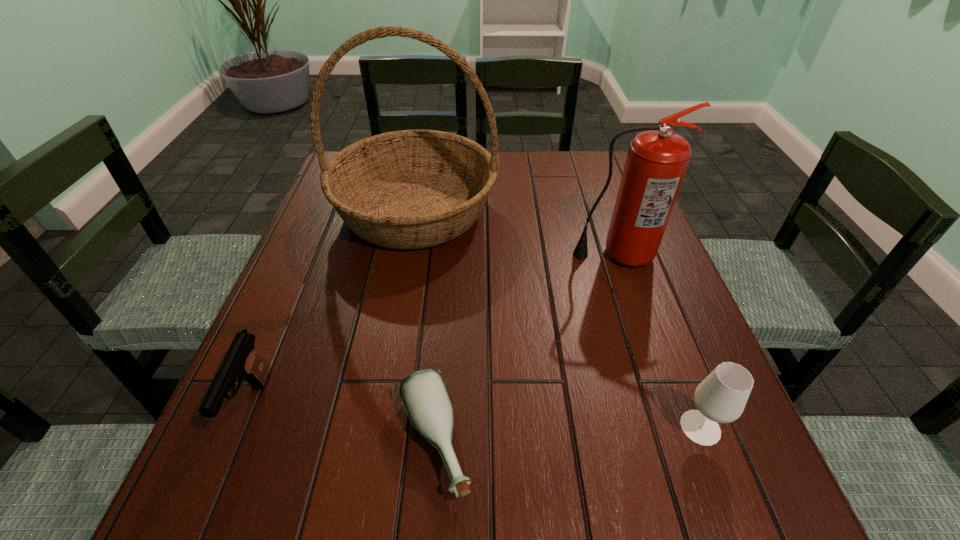
What are the coordinates of `vacant space at the near left corner of the desktop` in the screenshot? It's located at (260, 506).

Locate an element on the screen. vacant area that lies between the fire extinguisher and the third shortest object is located at coordinates (659, 341).

Identify the location of free spot between the tallest object and the second shortest object. The height and width of the screenshot is (540, 960). coord(333,307).

The width and height of the screenshot is (960, 540). In order to click on vacant area that lies between the fourth shortest object and the basket in this screenshot , I will do `click(516, 232)`.

This screenshot has height=540, width=960. I want to click on free space between the bottle and the second tallest object, so click(x=525, y=348).

The height and width of the screenshot is (540, 960). In order to click on free space between the pistol and the basket in this screenshot , I will do `click(333, 307)`.

The width and height of the screenshot is (960, 540). Find the location of `vacant space in between the glass and the basket`. vacant space in between the glass and the basket is located at coordinates (558, 319).

Locate an element on the screen. Image resolution: width=960 pixels, height=540 pixels. free space between the tallest object and the second tallest object is located at coordinates (516, 232).

Identify the location of free space between the third shortest object and the basket. (558, 319).

You are a GUI agent. You are given a task and a screenshot of the screen. Output one action in this format:
    pyautogui.click(x=<x>, y=<y>)
    Task: Click on the empty space that is in between the tallest object and the fire extinguisher
    
    Given the screenshot: What is the action you would take?
    pyautogui.click(x=516, y=232)